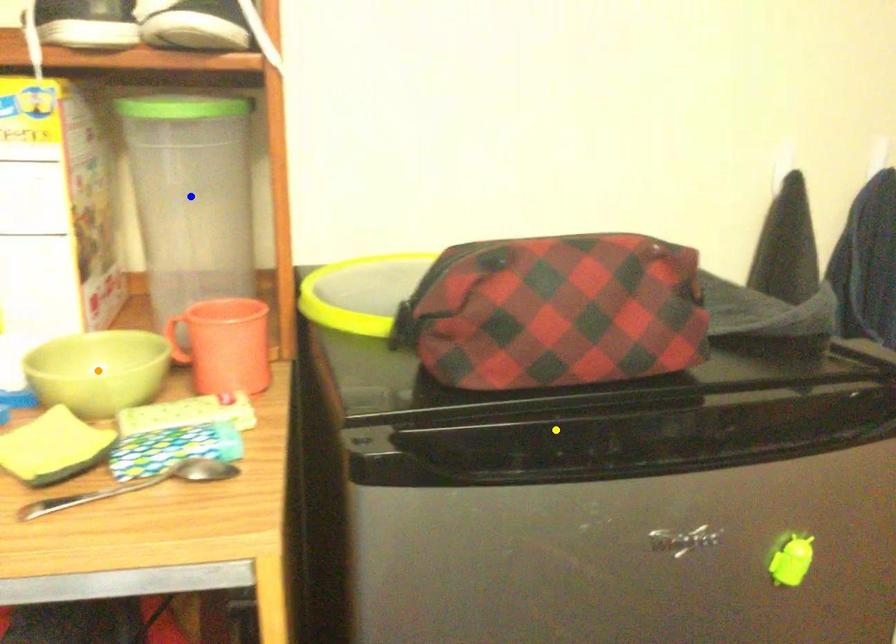
Order these from nearest to farthest:
yellow point, blue point, orange point

yellow point < orange point < blue point